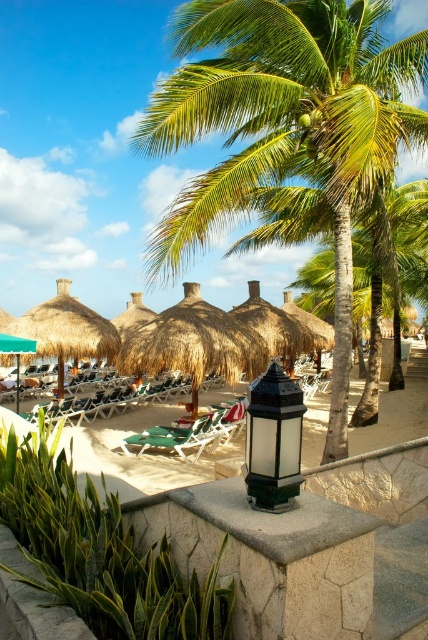
Question: Can you confirm if green glass lantern at center is positioned to the left of thatched straw umbrella at left?

Choices:
 (A) no
 (B) yes

Answer: (A)

Question: Estimate the real-world distances between objects in this image. Which object is farther from the green fabric beach chair at center?

Choices:
 (A) green glass lantern at center
 (B) thatched straw umbrella at left
 (C) green leafy palm tree at center

Answer: (A)

Question: Which point is farther from the camera taking this photo?

Choices:
 (A) (18, 316)
 (B) (330, 460)

Answer: (A)

Question: Which is nearer to the thatched straw umbrella at left?

Choices:
 (A) green leafy palm tree at center
 (B) green fabric beach chair at center
 (C) thatched straw umbrellas at center
 (D) green glass lantern at center

Answer: (C)

Question: Is thatched straw umbrella at left to the right of green fabric beach chair at center from the viewer's perspective?

Choices:
 (A) no
 (B) yes

Answer: (A)

Question: Does green glass lantern at center have a lesser width compared to thatched straw umbrella at left?

Choices:
 (A) yes
 (B) no

Answer: (A)